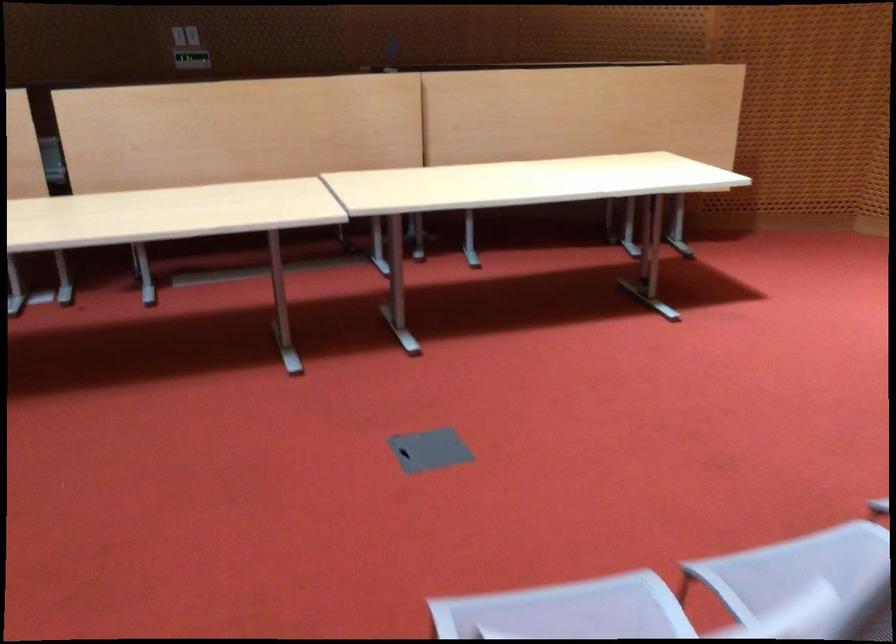
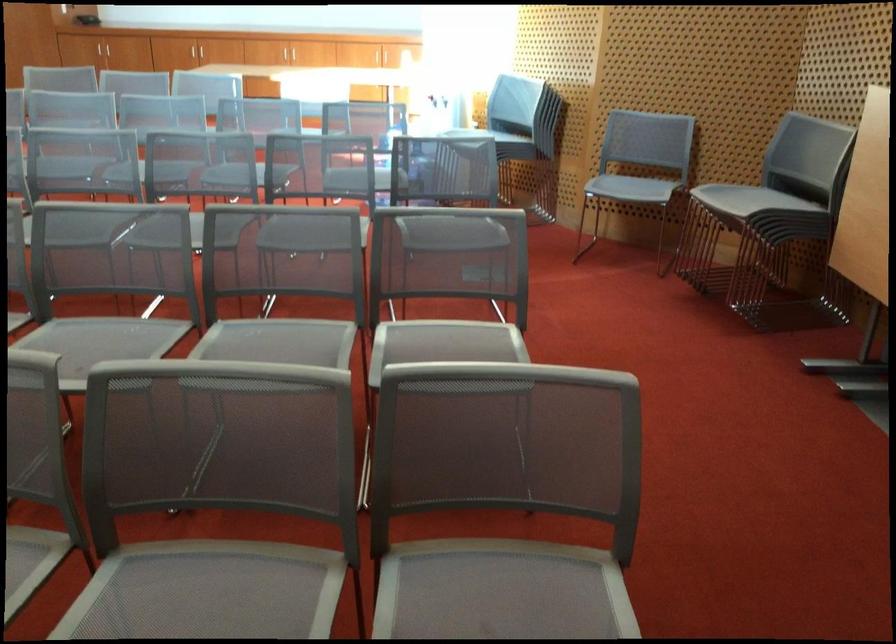
Question: Which direction would the cameraman need to move to produce the second image? Reply with the corresponding letter.

Choices:
 (A) Left
 (B) Right
 (C) Forward
 (D) Backward

Answer: (D)